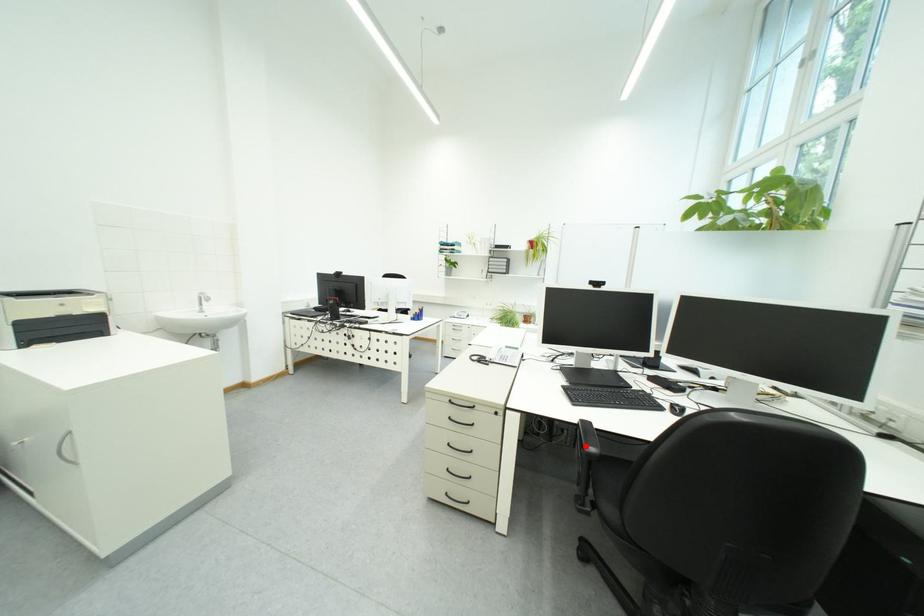
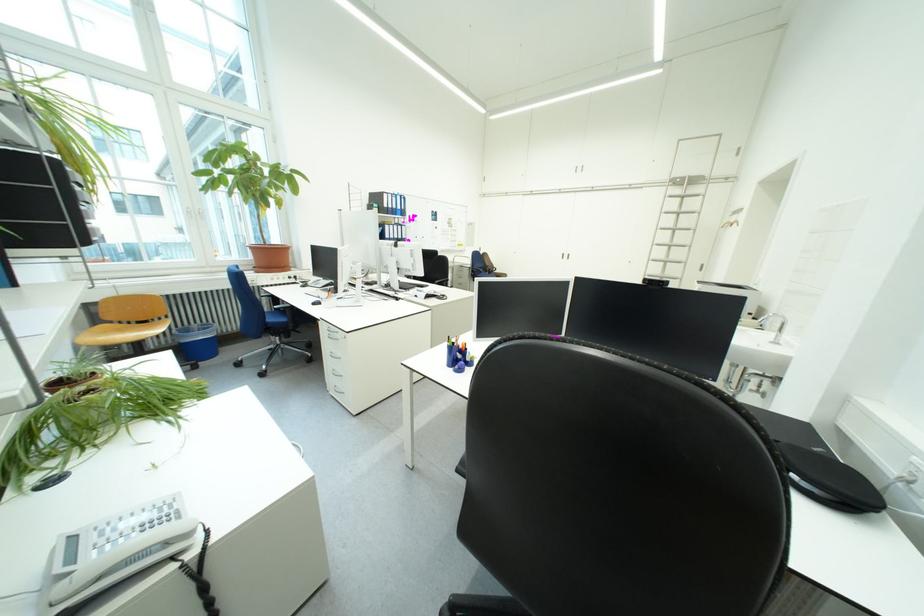
Question: I am providing you with two images of the same scene from different viewpoints. A red point is marked on the first image. Is the red point's position out of view in image 2?

Choices:
 (A) Yes
 (B) No

Answer: (A)